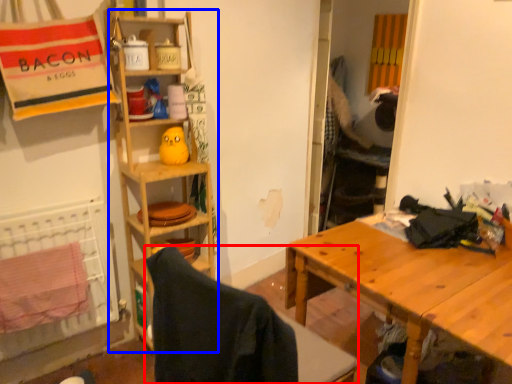
Question: Among these objects, which one is farthest to the camera, folding chair (highlighted by a red box) or shelf (highlighted by a blue box)?

Choices:
 (A) folding chair
 (B) shelf

Answer: (B)